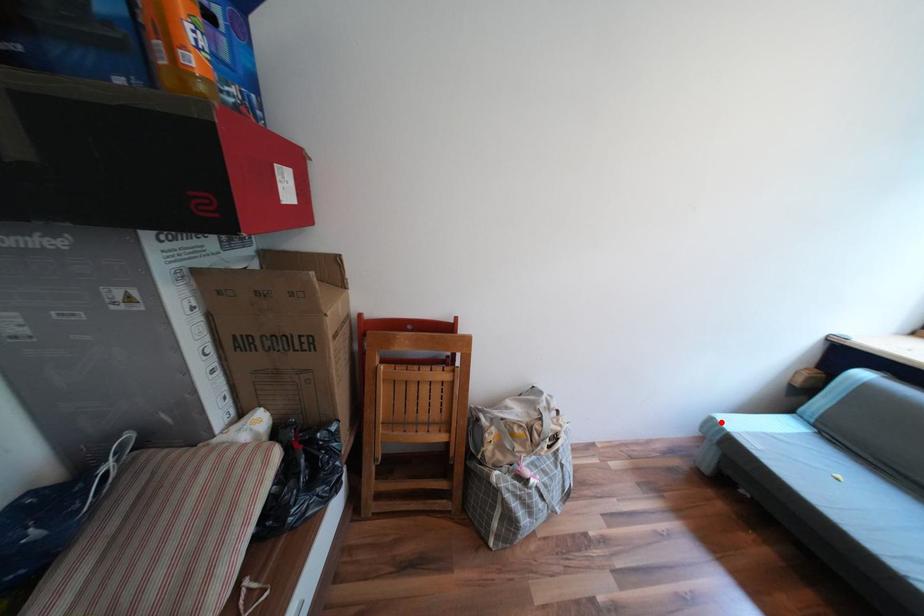
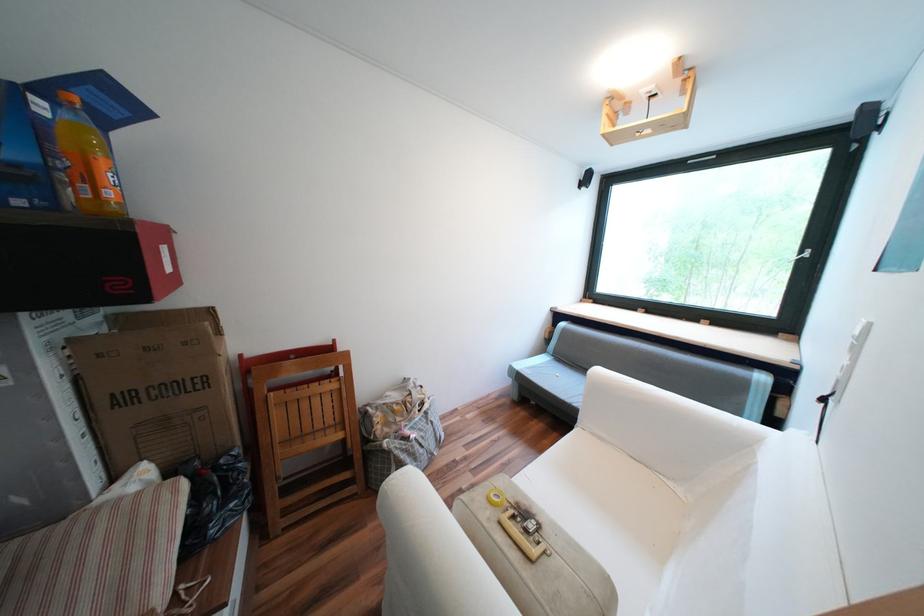
Question: I am providing you with two images of the same scene from different viewpoints. A red point is marked on the first image. Can you still see the location of the red point in image 2?

Choices:
 (A) Yes
 (B) No

Answer: (A)